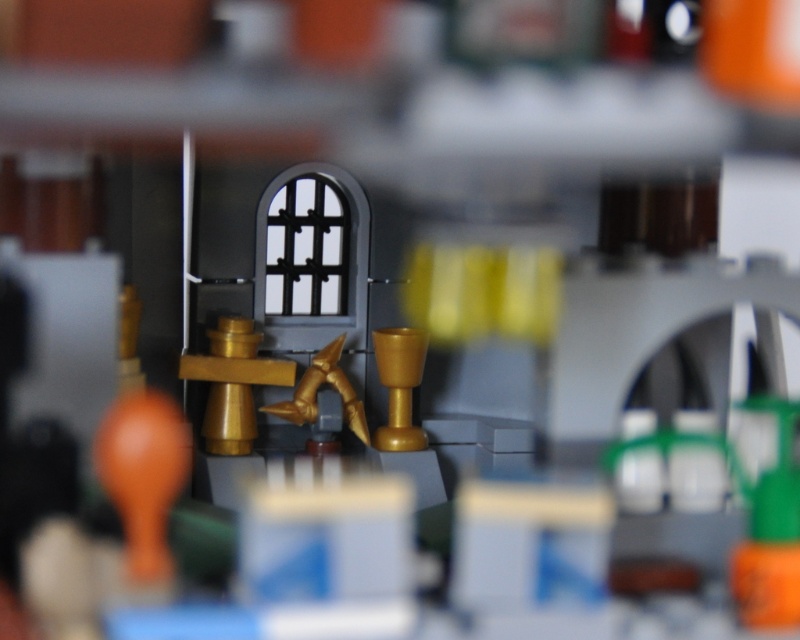
Question: Can you confirm if matte orange balloon at lower left is positioned to the left of gold metallic pipe at center?

Choices:
 (A) yes
 (B) no

Answer: (B)

Question: Does matte orange balloon at lower left appear on the left side of gold metallic chalice at center?

Choices:
 (A) yes
 (B) no

Answer: (A)

Question: Which object is closer to the camera taking this photo?

Choices:
 (A) gold metallic pipe at center
 (B) matte orange balloon at lower left
 (C) gold metallic goblet at center
 (D) gold metallic chalice at center

Answer: (B)

Question: Which point is closer to the camera?

Choices:
 (A) gold metallic goblet at center
 (B) gold metallic chalice at center

Answer: (A)

Question: Does gold metallic goblet at center have a smaller size compared to gold metallic chalice at center?

Choices:
 (A) yes
 (B) no

Answer: (B)

Question: Which object is the farthest from the gold metallic chalice at center?

Choices:
 (A) gold metallic pipe at center
 (B) gold metallic goblet at center
 (C) matte orange balloon at lower left

Answer: (C)